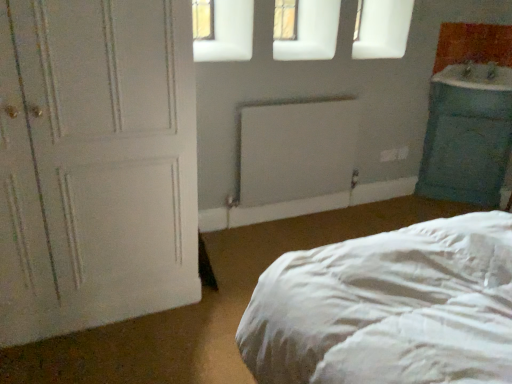
This screenshot has height=384, width=512. What are the coordinates of `vacant space in teal fabric pillow at right (from a real-world perspective)` in the screenshot? It's located at (450, 199).